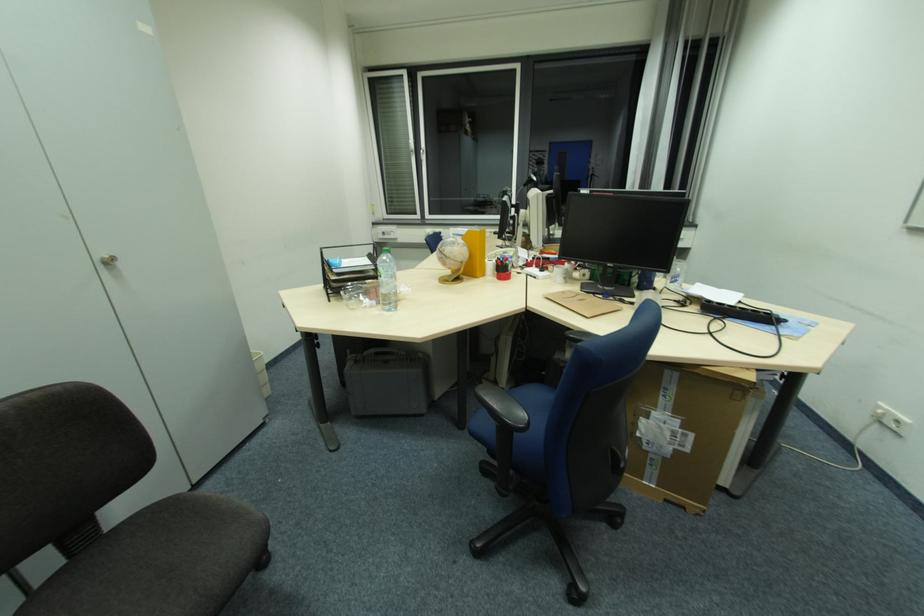
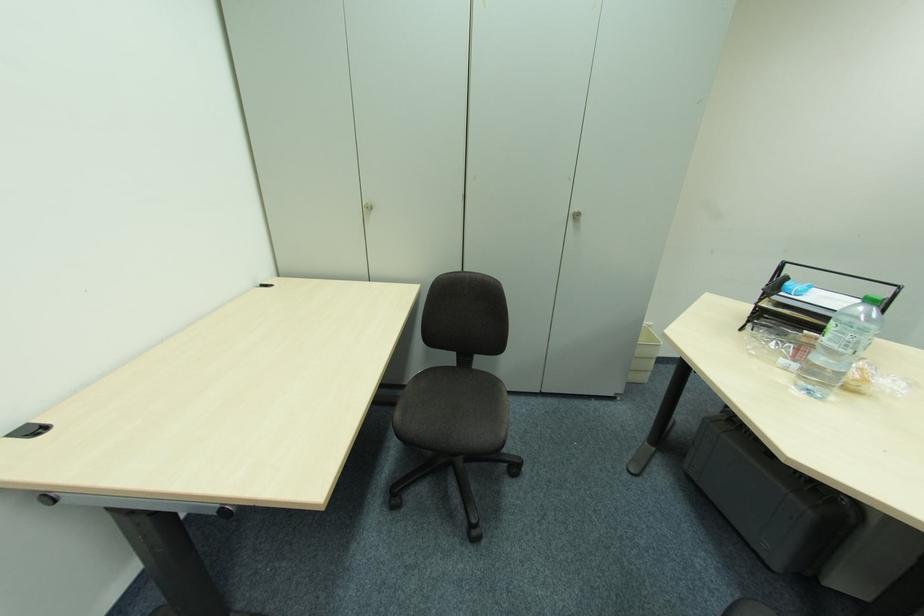
Find the pixel in the second image that matches (x=395, y=277) in the first image.

(850, 347)